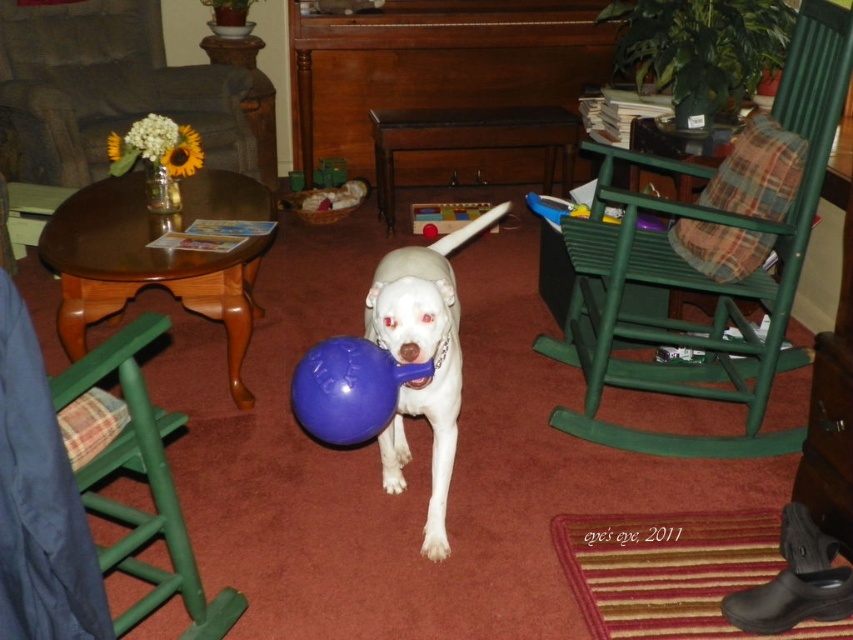
Looking at this image, you are a delivery robot with a package that measures 5 feet in length. You need to navigate through the living room to place the package between the green wood rocking chair at center right and the green wood rocking chair at lower left. Can you fit the package between them without bending it?

The distance between the green wood rocking chair at center right and the green wood rocking chair at lower left is 4.63 feet. Since the package is 5 feet long, it cannot fit between them without bending or repositioning.

You are a small toy that is 10 cm tall. You want to hide under the green wood rocking chair at lower left and the rubber blue ball at center. Which object can you hide under?

The green wood rocking chair at lower left is taller than the rubber blue ball at center, so you can hide under the green wood rocking chair at lower left since it has enough space.

You are a small toy mouse that is 10 cm tall. You want to hide under the green wood rocking chair at lower left without being seen by the rubber blue ball at center. Is this possible?

The green wood rocking chair at lower left is below rubber blue ball at center, so yes, the toy mouse can hide under the green wood rocking chair at lower left and remain unseen by the rubber blue ball at center.